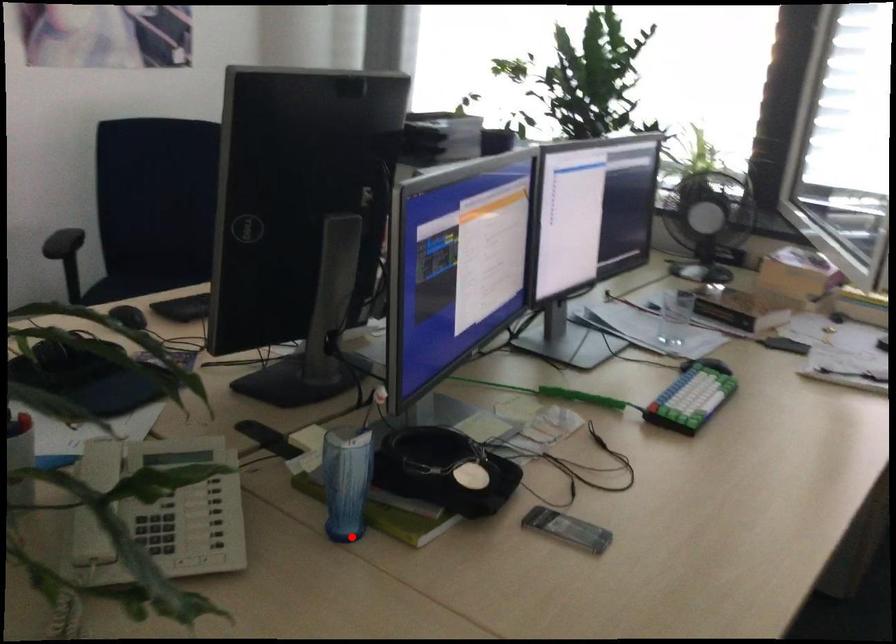
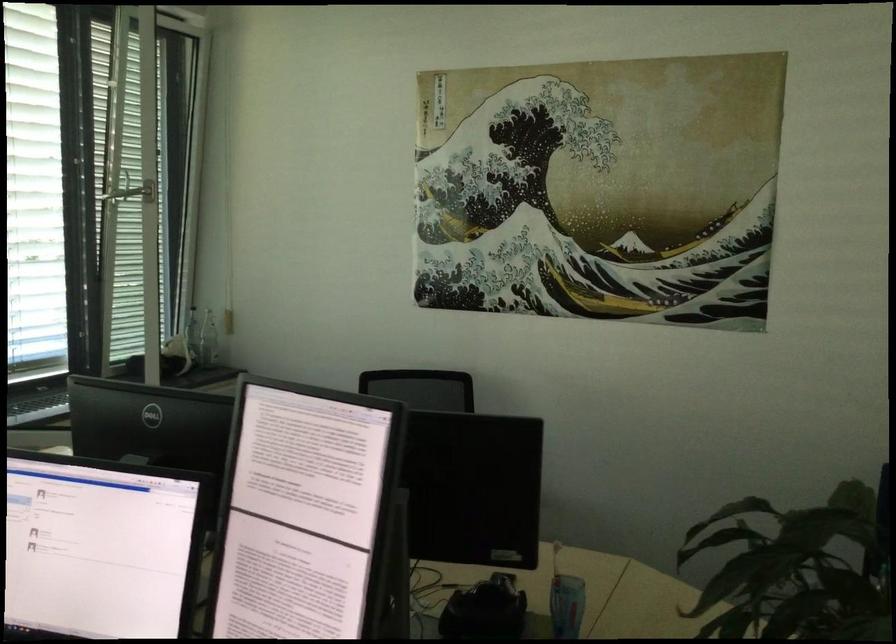
Question: A red point is marked in image1. In image2, is the corresponding 3D point closer to the camera or farther? Reply with the corresponding letter.

Choices:
 (A) The corresponding 3D point is closer.
 (B) The corresponding 3D point is farther.

Answer: (B)